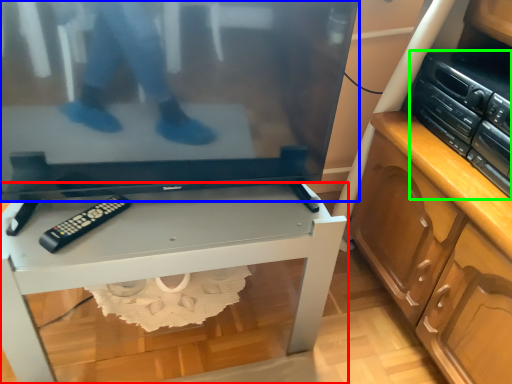
Question: Which is nearer to the desk (highlighted by a red box)? television (highlighted by a blue box) or stereo (highlighted by a green box).

Choices:
 (A) television
 (B) stereo

Answer: (A)